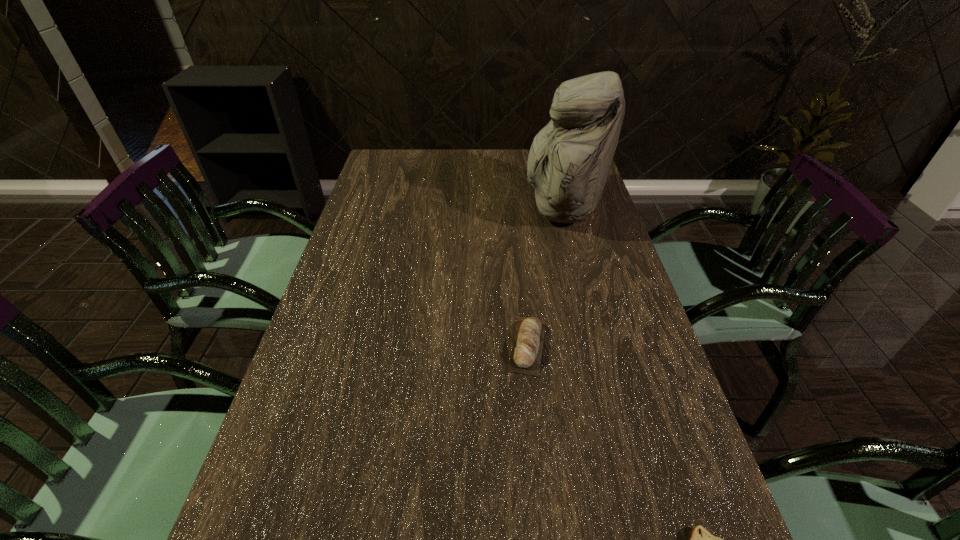
Image resolution: width=960 pixels, height=540 pixels. Identify the location of free spot at the left edge of the desktop. (280, 455).

Locate an element on the screen. The width and height of the screenshot is (960, 540). vacant region at the right edge of the desktop is located at coordinates (617, 272).

You are a GUI agent. You are given a task and a screenshot of the screen. Output one action in this format:
    pyautogui.click(x=<x>, y=<y>)
    Task: Click on the free point at the far left corner
    This screenshot has height=540, width=960.
    Given the screenshot: What is the action you would take?
    pyautogui.click(x=385, y=151)

At what (x,y) coordinates should I click in order to perform the action: click on vacant area between the farther pita bread and the farthest object. Please return your answer as a coordinate pair (x, y). The width and height of the screenshot is (960, 540). Looking at the image, I should click on (544, 277).

Where is `free area in between the farthest object and the second shortest object`? free area in between the farthest object and the second shortest object is located at coordinates (544, 277).

At what (x,y) coordinates should I click in order to perform the action: click on free space between the taller pita bread and the tallest object. Please return your answer as a coordinate pair (x, y). The image size is (960, 540). Looking at the image, I should click on (544, 277).

Locate an element on the screen. The width and height of the screenshot is (960, 540). empty space between the tallest object and the second nearest object is located at coordinates (544, 277).

Select which object is the closest to the nearer pita bread. Please provide its 2D coordinates. Your answer should be formatted as a tuple, i.e. [(x, y)], where the tuple contains the x and y coordinates of a point satisfying the conditions above.

[(527, 346)]

Identify which object is the closest to the tallest object. Please provide its 2D coordinates. Your answer should be formatted as a tuple, i.e. [(x, y)], where the tuple contains the x and y coordinates of a point satisfying the conditions above.

[(527, 346)]

Find the location of a particular element. This screenshot has width=960, height=540. free region that satisfies the following two spatial constraints: 1. on the front-facing side of the backpack; 2. on the front side of the second shortest object is located at coordinates (595, 346).